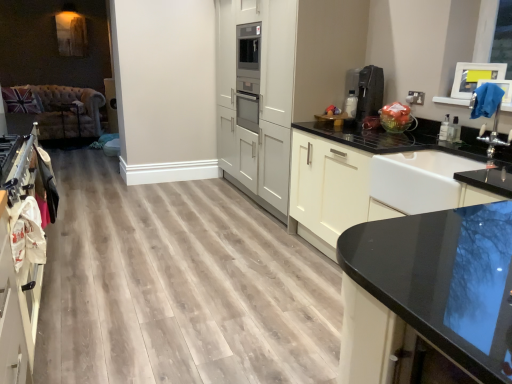
Find the location of `black plastic coffee machine at upper right`. black plastic coffee machine at upper right is located at coordinates (369, 92).

The image size is (512, 384). Identify the location of white glossy cabinet at center, the third cabinetry positioned from the left. (351, 171).

What is the approximate width of white matte cabinetry at center, arranged as the 2th cabinetry when viewed from the right?

white matte cabinetry at center, arranged as the 2th cabinetry when viewed from the right, is 27.13 inches in width.

What do you see at coordinates (428, 293) in the screenshot? The height and width of the screenshot is (384, 512). I see `black glossy countertop at center` at bounding box center [428, 293].

Describe the element at coordinates (426, 180) in the screenshot. I see `white glossy sink at right` at that location.

Identify the location of white matte cabinet at left, which is the 1th cabinetry from left to right. (20, 254).

Is point (411, 189) farther from camera compared to point (25, 314)?

Yes.

How different are the orientations of white glossy sink at right and white matte cabinet at left, the third cabinetry positioned from the right, in degrees?

They differ by 180 degrees in their facing directions.

Is white glossy sink at right placed right next to white matte cabinet at left, which is the 1th cabinetry from left to right?

No.

Does white matte cabinet at left, the third cabinetry positioned from the right, appear on the left side of white glossy sink at right?

Yes, white matte cabinet at left, the third cabinetry positioned from the right, is to the left of white glossy sink at right.

Is point (10, 206) farther from camera compared to point (450, 171)?

That is False.

Which of these two, white matte cabinet at left, which is the 1th cabinetry from left to right, or white glossy sink at right, is bigger?

With larger size is white matte cabinet at left, which is the 1th cabinetry from left to right.

Which of these two, white matte cabinet at left, the third cabinetry positioned from the right, or white glossy sink at right, stands taller?

white matte cabinet at left, the third cabinetry positioned from the right.

From a real-world perspective, relative to white glossy cabinet at center, the third cabinetry positioned from the left, is black glossy countertop at center vertically above or below?

black glossy countertop at center is situated higher than white glossy cabinet at center, the third cabinetry positioned from the left, in the real world.

What are the coordinates of `countertop above the white glossy cabinet at center, the third cabinetry positioned from the left (from a real-world perspective)` in the screenshot? It's located at (428, 293).

Considering the positions of point (498, 289) and point (365, 206), is point (498, 289) closer or farther from the camera than point (365, 206)?

Point (498, 289) is positioned closer to the camera compared to point (365, 206).

Is black glossy countertop at center touching white glossy cabinet at center, the 1th cabinetry in the right-to-left sequence?

black glossy countertop at center and white glossy cabinet at center, the 1th cabinetry in the right-to-left sequence, are not in contact.

Is white glossy sink at right closer to the viewer compared to black glossy countertop at center?

No.

Between white glossy sink at right and black glossy countertop at center, which one has smaller size?

Smaller between the two is white glossy sink at right.

Is white glossy sink at right oriented towards black glossy countertop at center?

No, white glossy sink at right is not oriented towards black glossy countertop at center.

Considering the relative sizes of white glossy sink at right and black glossy countertop at center in the image provided, is white glossy sink at right taller than black glossy countertop at center?

No, white glossy sink at right is not taller than black glossy countertop at center.

Relative to white glossy cabinet at center, the 1th cabinetry in the right-to-left sequence, is black plastic coffee machine at upper right in front or behind?

Clearly, black plastic coffee machine at upper right is behind white glossy cabinet at center, the 1th cabinetry in the right-to-left sequence.

Which is correct: black plastic coffee machine at upper right is inside white glossy cabinet at center, the 1th cabinetry in the right-to-left sequence, or outside of it?

black plastic coffee machine at upper right is spatially situated outside white glossy cabinet at center, the 1th cabinetry in the right-to-left sequence.

Considering the relative sizes of black plastic coffee machine at upper right and white glossy cabinet at center, the third cabinetry positioned from the left, in the image provided, is black plastic coffee machine at upper right wider than white glossy cabinet at center, the third cabinetry positioned from the left,?

No.

Is black plastic coffee machine at upper right with white glossy cabinet at center, the 1th cabinetry in the right-to-left sequence?

black plastic coffee machine at upper right is not next to white glossy cabinet at center, the 1th cabinetry in the right-to-left sequence, and they're not touching.

Considering the sizes of white matte cabinet at left, the third cabinetry positioned from the right, and black glossy countertop at center in the image, is white matte cabinet at left, the third cabinetry positioned from the right, bigger or smaller than black glossy countertop at center?

white matte cabinet at left, the third cabinetry positioned from the right, is smaller than black glossy countertop at center.

From the image's perspective, is white matte cabinet at left, the third cabinetry positioned from the right, located beneath black glossy countertop at center?

No.

From a real-world perspective, count 2nd cabinetrys downward from the black glossy countertop at center and point to it. Please provide its 2D coordinates.

[(20, 254)]

Is white matte cabinet at left, the third cabinetry positioned from the right, not inside black glossy countertop at center?

That's correct, white matte cabinet at left, the third cabinetry positioned from the right, is outside of black glossy countertop at center.

How many degrees apart are the facing directions of black plastic coffee machine at upper right and white matte cabinet at left, which is the 1th cabinetry from left to right?

180 degrees.

From a real-world perspective, is black plastic coffee machine at upper right below white matte cabinet at left, the third cabinetry positioned from the right?

No, from a real-world perspective, black plastic coffee machine at upper right is not beneath white matte cabinet at left, the third cabinetry positioned from the right.

Is black plastic coffee machine at upper right to the right of white matte cabinet at left, which is the 1th cabinetry from left to right, from the viewer's perspective?

Indeed, black plastic coffee machine at upper right is positioned on the right side of white matte cabinet at left, which is the 1th cabinetry from left to right.

Considering their positions, is black plastic coffee machine at upper right located in front of or behind white matte cabinet at left, the third cabinetry positioned from the right?

Clearly, black plastic coffee machine at upper right is behind white matte cabinet at left, the third cabinetry positioned from the right.

This screenshot has height=384, width=512. In order to click on the 2nd cabinetry below when counting from the white glossy sink at right (from the image's perspective) in this screenshot , I will do `click(20, 254)`.

You are a GUI agent. You are given a task and a screenshot of the screen. Output one action in this format:
    pyautogui.click(x=<x>, y=<y>)
    Task: Click on the cabinetry that is the 2nd object directly below the white glossy sink at right (from a real-world perspective)
    This screenshot has width=512, height=384.
    Given the screenshot: What is the action you would take?
    pyautogui.click(x=20, y=254)

Estimate the real-world distances between objects in this image. Which object is further from black plastic coffee machine at upper right, white glossy sink at right or white glossy cabinet at center, the third cabinetry positioned from the left?

white glossy sink at right lies further to black plastic coffee machine at upper right than the other object.

Looking at the image, which one is located further to white matte cabinetry at center, arranged as the 2th cabinetry when viewed from the right, white glossy cabinet at center, the 1th cabinetry in the right-to-left sequence, or white glossy sink at right?

white glossy sink at right is further to white matte cabinetry at center, arranged as the 2th cabinetry when viewed from the right.

Looking at the image, which one is located further to white glossy sink at right, white matte cabinet at left, which is the 1th cabinetry from left to right, or black plastic coffee machine at upper right?

white matte cabinet at left, which is the 1th cabinetry from left to right, is further to white glossy sink at right.

When comparing their distances from black plastic coffee machine at upper right, does white glossy cabinet at center, the third cabinetry positioned from the left, or white matte cabinetry at center, placed as the 2th cabinetry when sorted from left to right, seem closer?

white glossy cabinet at center, the third cabinetry positioned from the left, lies closer to black plastic coffee machine at upper right than the other object.

Based on their spatial positions, is white glossy cabinet at center, the 1th cabinetry in the right-to-left sequence, or white matte cabinetry at center, arranged as the 2th cabinetry when viewed from the right, closer to white matte cabinet at left, the third cabinetry positioned from the right?

Based on the image, white glossy cabinet at center, the 1th cabinetry in the right-to-left sequence, appears to be nearer to white matte cabinet at left, the third cabinetry positioned from the right.

Estimate the real-world distances between objects in this image. Which object is closer to white glossy sink at right, white matte cabinetry at center, placed as the 2th cabinetry when sorted from left to right, or white glossy cabinet at center, the third cabinetry positioned from the left?

The object closer to white glossy sink at right is white glossy cabinet at center, the third cabinetry positioned from the left.

When comparing their distances from black plastic coffee machine at upper right, does white matte cabinet at left, which is the 1th cabinetry from left to right, or white glossy cabinet at center, the 1th cabinetry in the right-to-left sequence, seem further?

Based on the image, white matte cabinet at left, which is the 1th cabinetry from left to right, appears to be further to black plastic coffee machine at upper right.

When comparing their distances from white glossy sink at right, does white matte cabinet at left, the third cabinetry positioned from the right, or white matte cabinetry at center, arranged as the 2th cabinetry when viewed from the right, seem further?

Among the two, white matte cabinet at left, the third cabinetry positioned from the right, is located further to white glossy sink at right.

This screenshot has width=512, height=384. I want to click on countertop situated between white matte cabinet at left, the third cabinetry positioned from the right, and black plastic coffee machine at upper right from left to right, so click(428, 293).

Where is `sink between white glossy cabinet at center, the third cabinetry positioned from the left, and black plastic coffee machine at upper right in the front-back direction`? sink between white glossy cabinet at center, the third cabinetry positioned from the left, and black plastic coffee machine at upper right in the front-back direction is located at coordinates (426, 180).

You are a GUI agent. You are given a task and a screenshot of the screen. Output one action in this format:
    pyautogui.click(x=<x>, y=<y>)
    Task: Click on the cabinetry situated between white matte cabinet at left, which is the 1th cabinetry from left to right, and white glossy cabinet at center, the 1th cabinetry in the right-to-left sequence, from left to right
    Image resolution: width=512 pixels, height=384 pixels.
    Given the screenshot: What is the action you would take?
    click(291, 70)

At what (x,y) coordinates should I click in order to perform the action: click on cabinetry between white glossy cabinet at center, the third cabinetry positioned from the left, and black plastic coffee machine at upper right in the front-back direction. Please return your answer as a coordinate pair (x, y). This screenshot has height=384, width=512. Looking at the image, I should click on (291, 70).